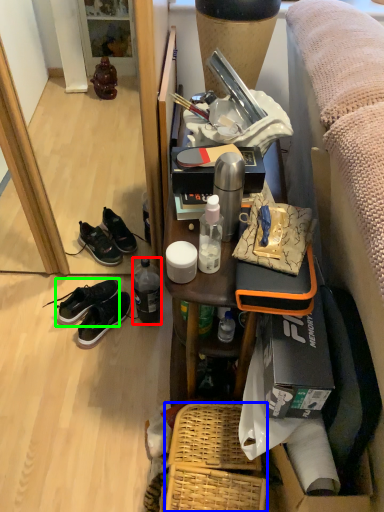
Question: Estimate the real-world distances between objects in this image. Which object is closer to bottle (highlighted by a red box), picnic basket (highlighted by a blue box) or shoe (highlighted by a green box)?

Choices:
 (A) picnic basket
 (B) shoe

Answer: (B)